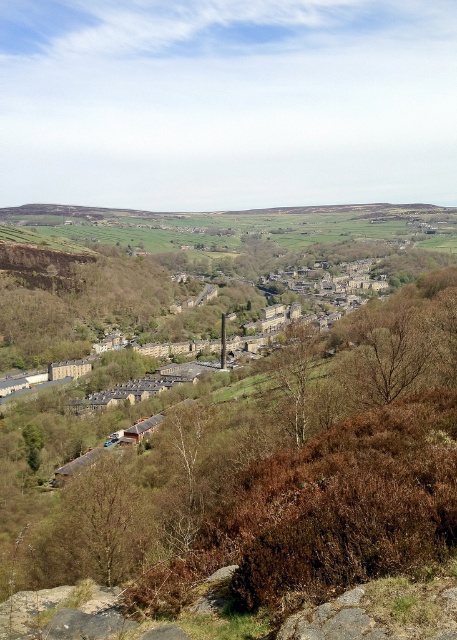
You are a surveyor measuring distances between landmarks in a valley. You need to determine if a 40 meter long rope can span between the brown textured tree at lower left and the brown textured tree at center. Can the rope reach?

The distance between the brown textured tree at lower left and the brown textured tree at center is 42.29 meters, so the 40 meter rope is too short to span the gap between them.

You are an environmental scientist assessing the health of the valley. You observe the bare branches at center and the brown textured tree at center. Which of these two trees is taller?

The brown textured tree at center is taller than the bare branches at center.